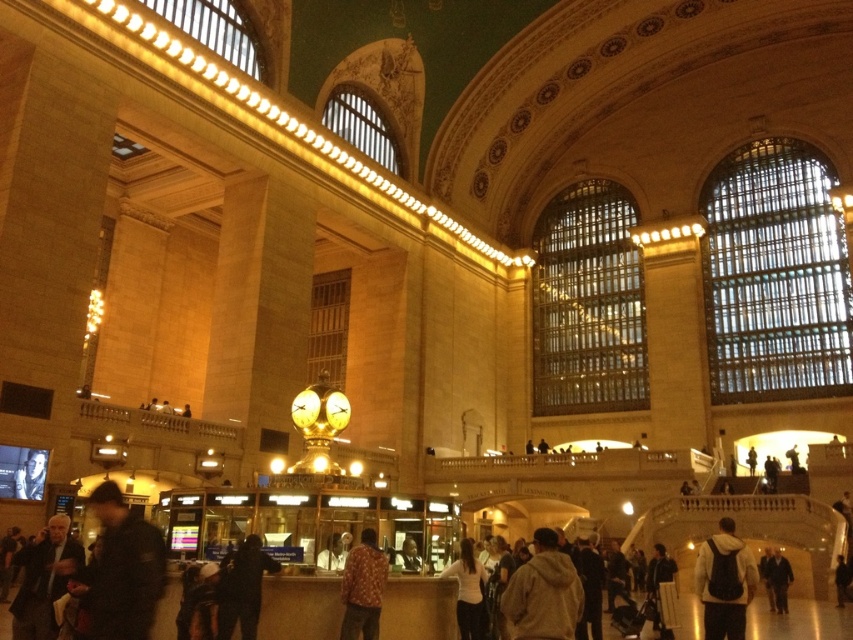
You are a photographer preparing for a photoshoot in the grand train station. You need to choose between the dark gray hoodie at lower center and the dark brown leather jacket at lower right based on their sizes. Which one should you wear if you want to ensure your outfit is more noticeable in the photo?

The dark gray hoodie at lower center has a larger size compared to the dark brown leather jacket at lower right, so you should wear the dark gray hoodie at lower center to be more noticeable in the photo.

You are standing in the grand train station and see a dark gray jacket at lower left and a floral shirt at center. Which item is nearer to you?

The dark gray jacket at lower left is closer to the viewer than the floral shirt at center.

You are a tour guide leading a group through the train station. You notice a tourist wearing a white hoodie at center and another tourist wearing a floral shirt at center. If the average walking speed is 3 feet per second, how many seconds will it take for them to meet if they start walking towards each other simultaneously?

The white hoodie at center and floral shirt at center are 61.13 feet apart. If they walk towards each other at 3 feet per second each, their combined speed is 6 feet per second. Dividing the distance by the combined speed gives 61.13 divided by 6, which equals approximately 10.19 seconds. So, it will take about 10.2 seconds for them to meet.